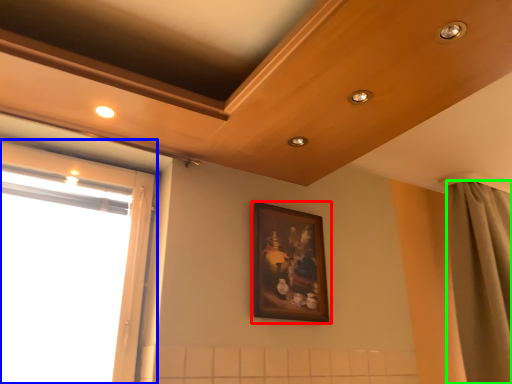
Question: Which object is positioned closest to picture frame (highlighted by a red box)? Select from window (highlighted by a blue box) and curtain (highlighted by a green box).

Choices:
 (A) window
 (B) curtain

Answer: (A)